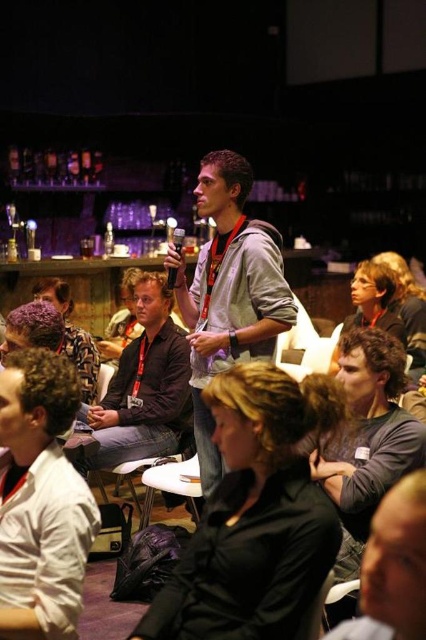
Consider the image. Is black matte shirt at center bigger than dark brown hair at center?

No, black matte shirt at center is not bigger than dark brown hair at center.

Is black matte shirt at center smaller than dark brown hair at center?

Yes, black matte shirt at center is smaller than dark brown hair at center.

The height and width of the screenshot is (640, 426). In order to click on black matte shirt at center in this screenshot , I will do `click(255, 515)`.

Can you confirm if gray hoodie at center is thinner than dark brown hair at center?

No.

Does point (218, 362) come closer to viewer compared to point (400, 285)?

That is True.

In order to click on gray hoodie at center in this screenshot , I will do `click(229, 292)`.

Who is taller, white cotton shirt at lower left or dark gray hoodie at center?

white cotton shirt at lower left is taller.

Between white cotton shirt at lower left and dark gray hoodie at center, which one has less height?

dark gray hoodie at center

This screenshot has height=640, width=426. What do you see at coordinates (40, 500) in the screenshot?
I see `white cotton shirt at lower left` at bounding box center [40, 500].

This screenshot has width=426, height=640. I want to click on white cotton shirt at lower left, so click(x=40, y=500).